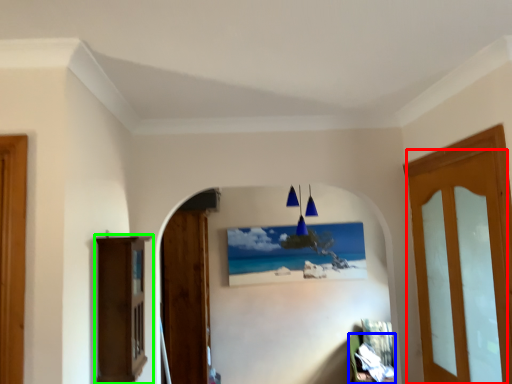
Question: Which is nearer to the door (highlighted by a red box)? furniture (highlighted by a blue box) or furniture (highlighted by a green box).

Choices:
 (A) furniture
 (B) furniture

Answer: (B)